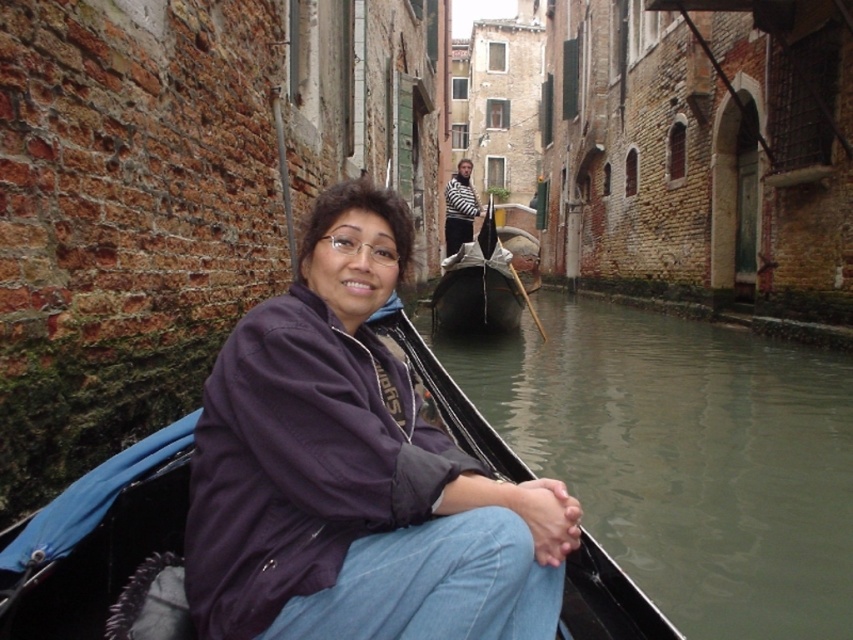
Is greenish water at lower left thinner than black polished wood gondola at center?

Indeed, greenish water at lower left has a lesser width compared to black polished wood gondola at center.

Is point (589, 456) positioned before point (453, 292)?

Yes, it is.

Locate an element on the screen. This screenshot has width=853, height=640. greenish water at lower left is located at coordinates (683, 456).

The image size is (853, 640). I want to click on greenish water at lower left, so click(683, 456).

Which of these two, purple fabric jacket at center or black polished wood gondola at center, stands shorter?

purple fabric jacket at center

Who is taller, purple fabric jacket at center or black polished wood gondola at center?

With more height is black polished wood gondola at center.

Which is in front, point (294, 349) or point (509, 307)?

Point (294, 349) is more forward.

You are a GUI agent. You are given a task and a screenshot of the screen. Output one action in this format:
    pyautogui.click(x=<x>, y=<y>)
    Task: Click on the purple fabric jacket at center
    The height and width of the screenshot is (640, 853).
    Given the screenshot: What is the action you would take?
    pyautogui.click(x=354, y=472)

Between purple fabric jacket at center and greenish water at lower left, which one appears on the left side from the viewer's perspective?

From the viewer's perspective, purple fabric jacket at center appears more on the left side.

Can you confirm if purple fabric jacket at center is positioned below greenish water at lower left?

No.

Who is more forward, (572,529) or (849,412)?

Point (572,529) is in front.

Where is `purple fabric jacket at center`? purple fabric jacket at center is located at coordinates (354, 472).